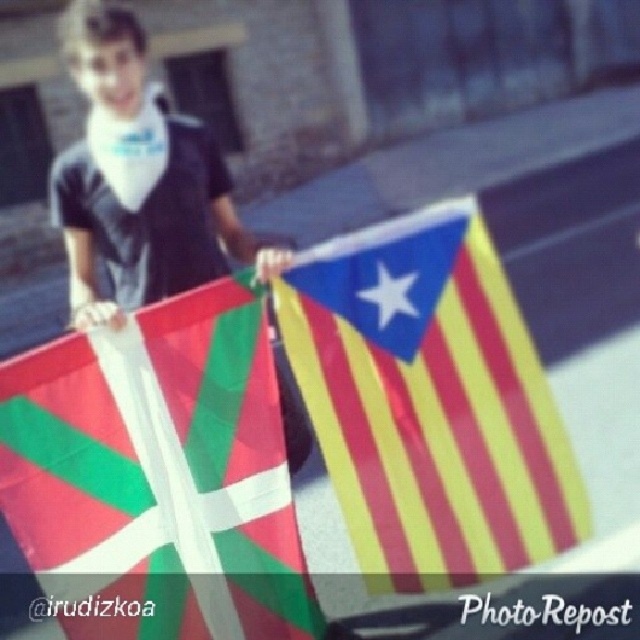
Is polyester flag at center behind yellow striped fabric at center?

No, polyester flag at center is in front of yellow striped fabric at center.

Does polyester flag at center have a lesser width compared to yellow striped fabric at center?

Indeed, polyester flag at center has a lesser width compared to yellow striped fabric at center.

The image size is (640, 640). Find the location of `polyester flag at center`. polyester flag at center is located at coordinates coord(157,474).

Identify the location of polyester flag at center. Image resolution: width=640 pixels, height=640 pixels. (157, 474).

Between yellow striped fabric at center and matte black shirt at upper left, which one appears on the left side from the viewer's perspective?

Positioned to the left is matte black shirt at upper left.

What do you see at coordinates (429, 400) in the screenshot?
I see `yellow striped fabric at center` at bounding box center [429, 400].

You are a GUI agent. You are given a task and a screenshot of the screen. Output one action in this format:
    pyautogui.click(x=<x>, y=<y>)
    Task: Click on the yellow striped fabric at center
    The width and height of the screenshot is (640, 640).
    Given the screenshot: What is the action you would take?
    pyautogui.click(x=429, y=400)

How distant is polyester flag at center from matte black shirt at upper left?

polyester flag at center is 16.81 inches from matte black shirt at upper left.

Based on the photo, can you confirm if polyester flag at center is thinner than matte black shirt at upper left?

Incorrect, polyester flag at center's width is not less than matte black shirt at upper left's.

Identify the location of polyester flag at center. The height and width of the screenshot is (640, 640). (157, 474).